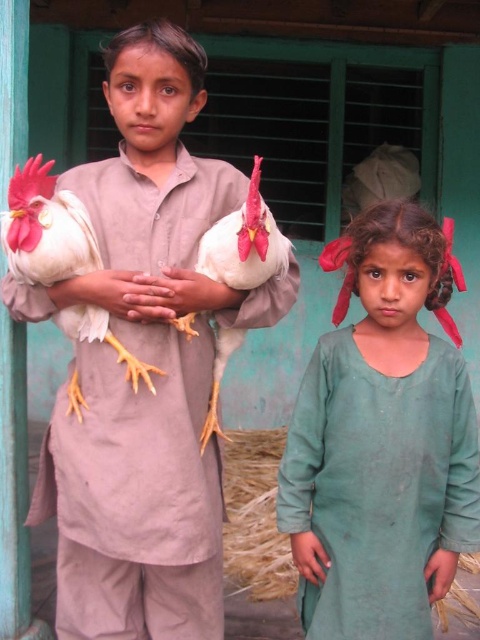
Question: Which of the following is the farthest from the observer?

Choices:
 (A) white feathered rooster at left
 (B) white feathered chicken at left
 (C) green fabric dress at lower right

Answer: (C)

Question: Is white feathered rooster at left bigger than green fabric dress at lower right?

Choices:
 (A) yes
 (B) no

Answer: (A)

Question: Can you confirm if white feathered rooster at left is positioned to the right of green fabric dress at lower right?

Choices:
 (A) yes
 (B) no

Answer: (B)

Question: Which point is farther to the camera?

Choices:
 (A) (194, 618)
 (B) (458, 548)

Answer: (A)

Question: Which object is farther from the camera taking this photo?

Choices:
 (A) white feathered rooster at left
 (B) white feathered chicken at left

Answer: (A)

Question: Is white feathered rooster at left to the left of green fabric dress at lower right from the viewer's perspective?

Choices:
 (A) yes
 (B) no

Answer: (A)